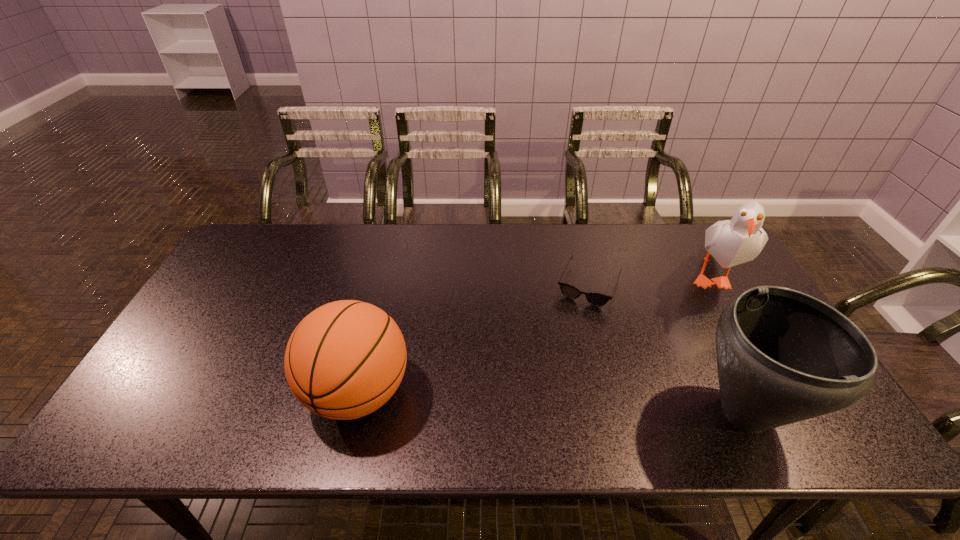
What are the coordinates of `free space on the desktop that is between the leftmost object and the urn and is positioned on the front lenses of the third object from right to left` in the screenshot? It's located at (541, 401).

Where is `free space on the desktop that is between the basketball and the urn and is positioned at the beak of the gull`? The height and width of the screenshot is (540, 960). free space on the desktop that is between the basketball and the urn and is positioned at the beak of the gull is located at coordinates (561, 402).